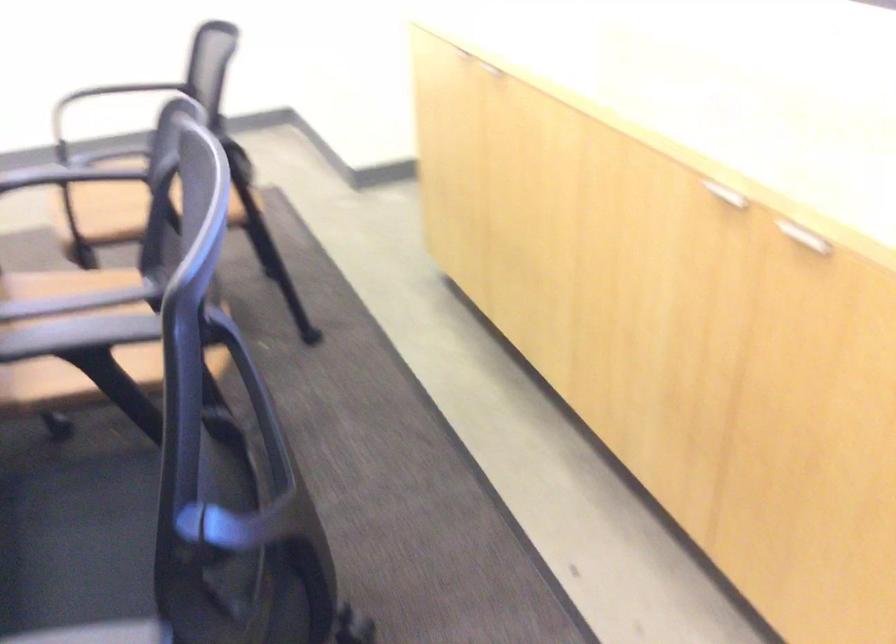
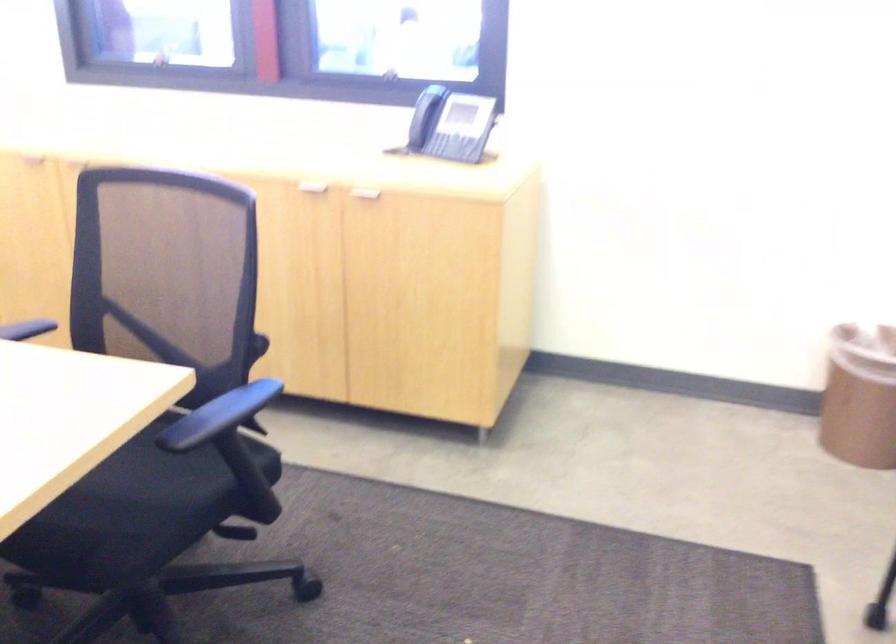
The point at (719, 194) is marked in the first image. Where is the corresponding point in the second image?

(305, 187)